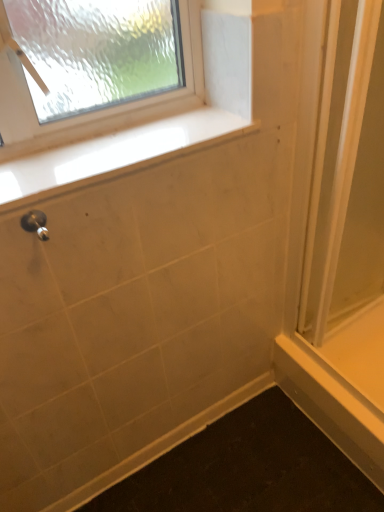
Question: Is point (354, 0) closer or farther from the camera than point (39, 228)?

Choices:
 (A) closer
 (B) farther

Answer: (B)

Question: Looking at their shapes, would you say clear plastic screen door at right is wider or thinner than matte silver shower at lower left?

Choices:
 (A) thin
 (B) wide

Answer: (B)

Question: Which object is positioned closest to the clear plastic screen door at right?

Choices:
 (A) white glossy window sill at upper center
 (B) matte silver shower at lower left

Answer: (A)

Question: Which of these objects is positioned closest to the matte silver shower at lower left?

Choices:
 (A) clear plastic screen door at right
 (B) white glossy window sill at upper center

Answer: (B)